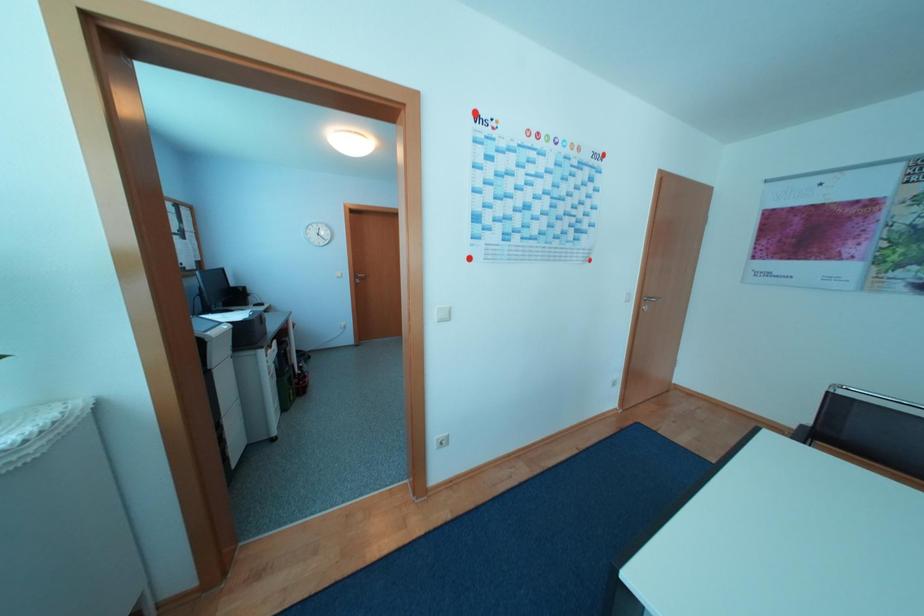
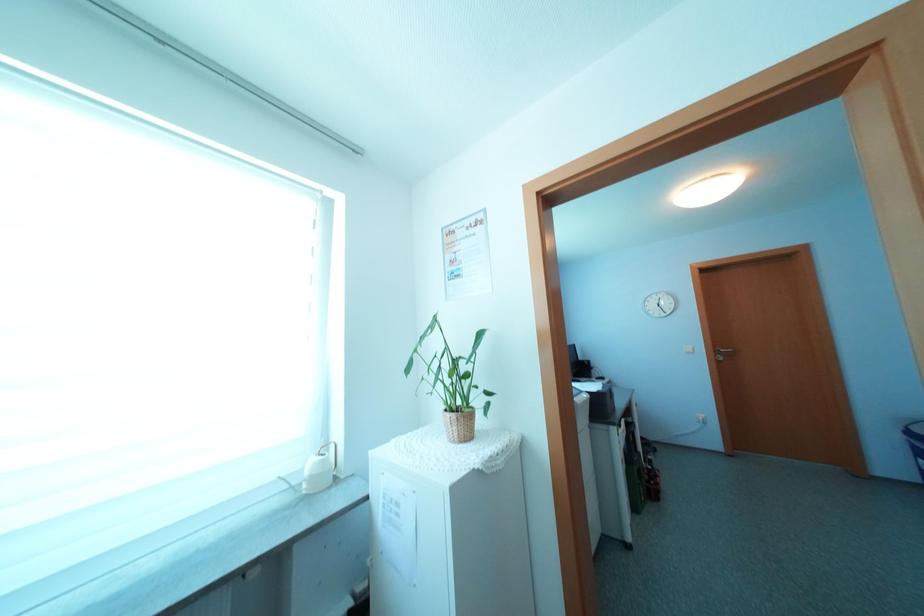
Question: The camera is either moving clockwise (left) or counter-clockwise (right) around the object. The first image is from the beginning of the video and the second image is from the end. Is the camera moving left or right when shooting the video?

Choices:
 (A) Left
 (B) Right

Answer: (B)